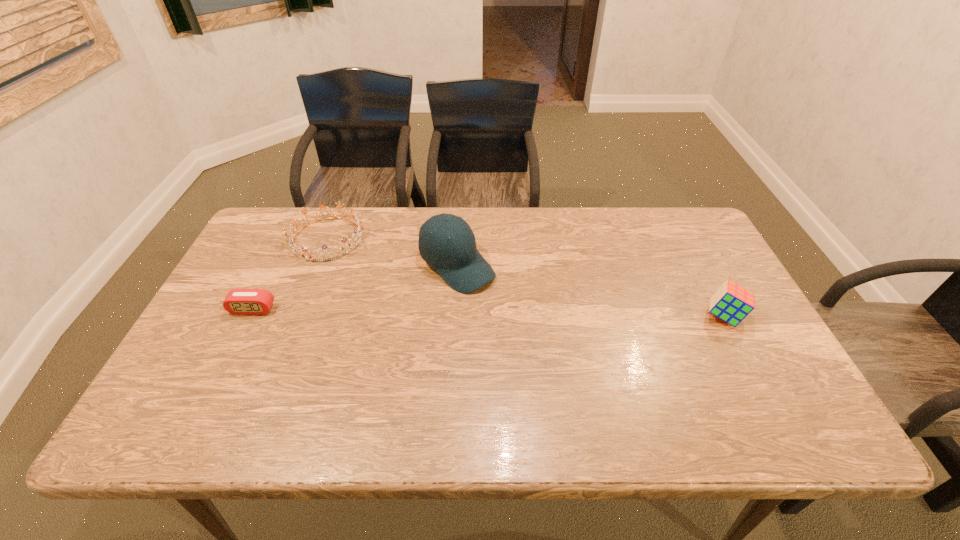
Find the location of a particular element. This screenshot has width=960, height=540. free space that is in between the shortest object and the rightmost object is located at coordinates (489, 313).

This screenshot has height=540, width=960. I want to click on free point between the cube and the shortest object, so click(489, 313).

At what (x,y) coordinates should I click in order to perform the action: click on unoccupied position between the third tallest object and the shortest object. Please return your answer as a coordinate pair (x, y). Looking at the image, I should click on (290, 274).

The image size is (960, 540). In order to click on free space that is in between the baseball cap and the shortest object in this screenshot , I will do `click(355, 287)`.

The height and width of the screenshot is (540, 960). I want to click on unoccupied position between the tiara and the tallest object, so click(393, 252).

You are a GUI agent. You are given a task and a screenshot of the screen. Output one action in this format:
    pyautogui.click(x=<x>, y=<y>)
    Task: Click on the vacant space that is in between the third object from left to right and the second shortest object
    The height and width of the screenshot is (540, 960).
    Given the screenshot: What is the action you would take?
    pyautogui.click(x=393, y=252)

Identify the location of empty space that is in between the shortest object and the tallest object. This screenshot has width=960, height=540. (355, 287).

Select which object appears as the closest to the third shortest object. Please provide its 2D coordinates. Your answer should be formatted as a tuple, i.e. [(x, y)], where the tuple contains the x and y coordinates of a point satisfying the conditions above.

[(457, 260)]

Identify which object is the nearest to the second tallest object. Please provide its 2D coordinates. Your answer should be formatted as a tuple, i.e. [(x, y)], where the tuple contains the x and y coordinates of a point satisfying the conditions above.

[(457, 260)]

Where is `free space in the image that satisfies the following two spatial constraints: 1. on the front side of the tiara; 2. on the left side of the tallest object`? This screenshot has width=960, height=540. free space in the image that satisfies the following two spatial constraints: 1. on the front side of the tiara; 2. on the left side of the tallest object is located at coordinates (317, 266).